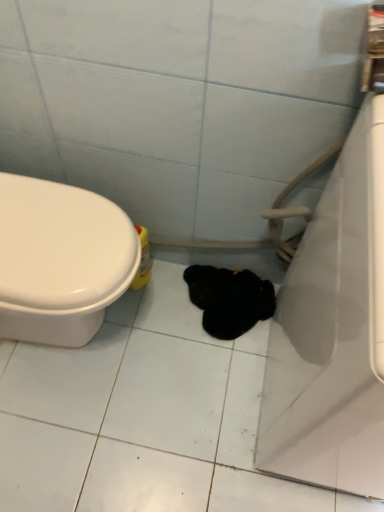
I want to click on free space in front of black fuzzy animal at center, so click(210, 372).